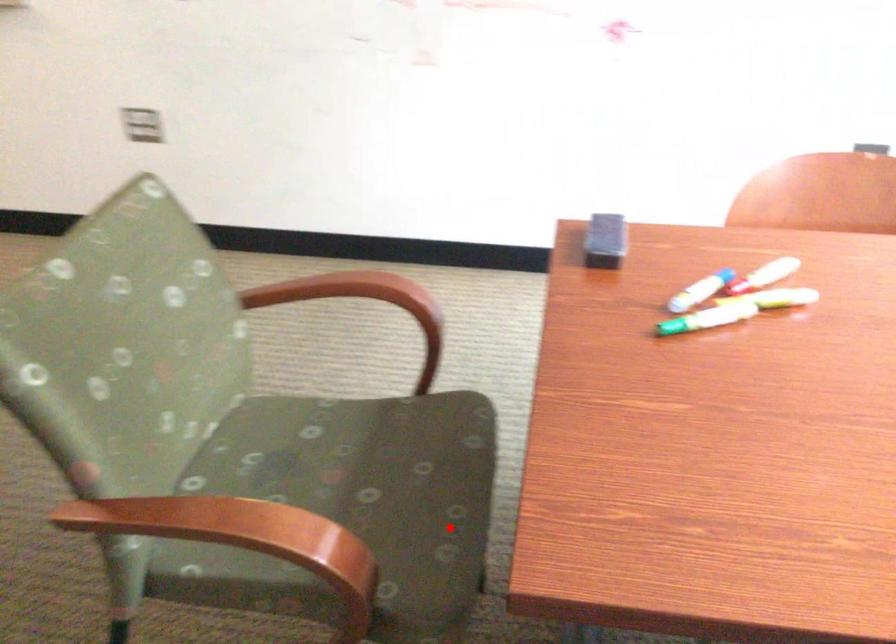
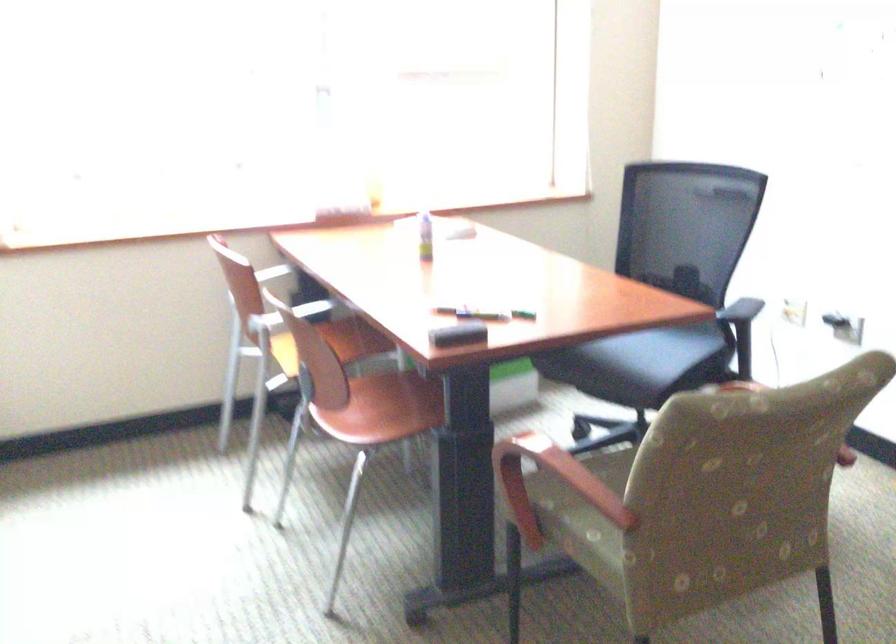
Question: I am providing you with two images of the same scene from different viewpoints. Image1 has a red point marked. In image2, the corresponding 3D location appears at what relative position? Reply with the corresponding letter.

Choices:
 (A) Closer
 (B) Farther

Answer: (B)